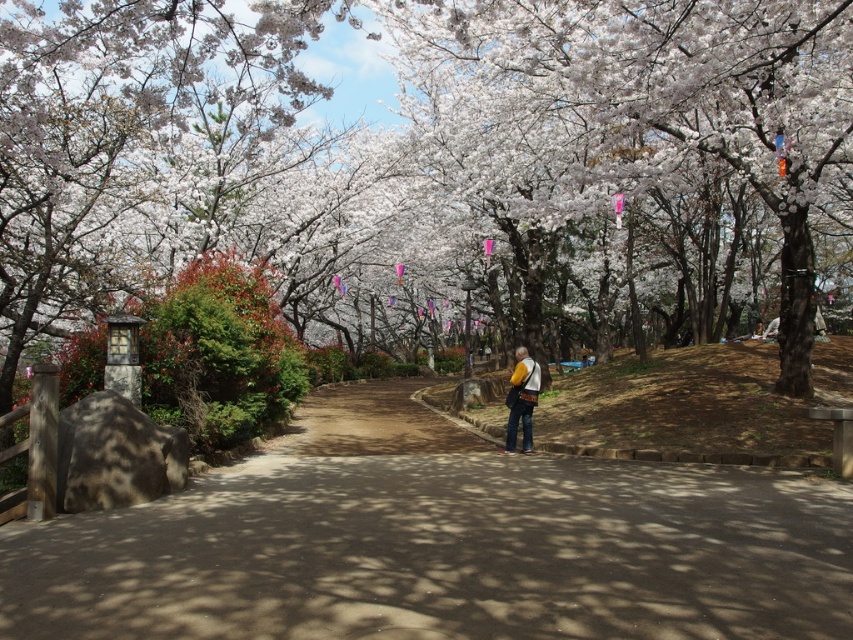
Is white blossoms at center behind yellow fabric bag at center?

No, white blossoms at center is in front of yellow fabric bag at center.

Image resolution: width=853 pixels, height=640 pixels. Describe the element at coordinates (426, 160) in the screenshot. I see `white blossoms at center` at that location.

The width and height of the screenshot is (853, 640). Identify the location of white blossoms at center. (426, 160).

Based on the photo, does brown dirt path at center appear over yellow fabric bag at center?

No.

Can you confirm if brown dirt path at center is positioned to the right of yellow fabric bag at center?

In fact, brown dirt path at center is to the left of yellow fabric bag at center.

The width and height of the screenshot is (853, 640). What are the coordinates of `brown dirt path at center` in the screenshot? It's located at (439, 545).

Identify the location of brown dirt path at center. The image size is (853, 640). click(x=439, y=545).

Is point (279, 253) closer to viewer compared to point (798, 474)?

No, (279, 253) is behind (798, 474).

Which is in front, point (751, 17) or point (631, 618)?

Point (631, 618) is in front.

Which is in front, point (529, 49) or point (410, 476)?

Point (410, 476) is in front.

What are the coordinates of `white blossoms at center` in the screenshot? It's located at (426, 160).